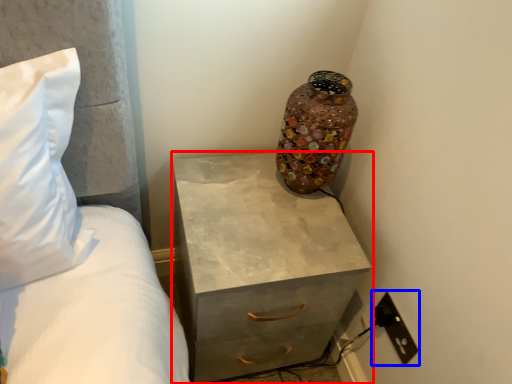
Question: Which object is closer to the camera taking this photo, chest of drawers (highlighted by a red box) or electric outlet (highlighted by a blue box)?

Choices:
 (A) chest of drawers
 (B) electric outlet

Answer: (A)